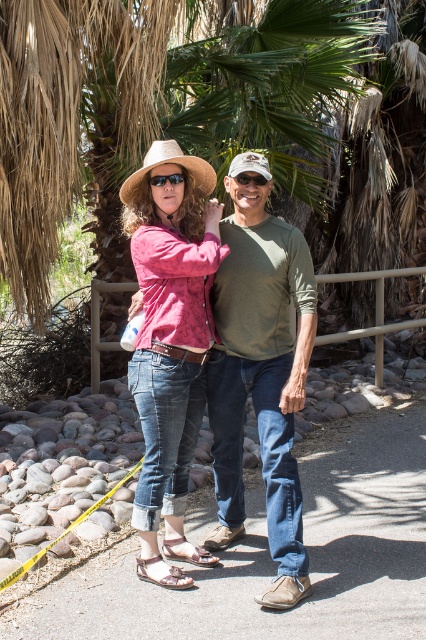
Question: Which of the following is the farthest from the observer?

Choices:
 (A) green matte shirt at center
 (B) white matte cowboy hat at center
 (C) brown leather sandal at lower center

Answer: (C)

Question: Observing the image, what is the correct spatial positioning of leather textured sandal at lower left in reference to matte black sunglasses at center?

Choices:
 (A) above
 (B) below

Answer: (B)

Question: Does brown textured palm tree at center have a larger size compared to matte pink shirt at center?

Choices:
 (A) yes
 (B) no

Answer: (B)

Question: Among these points, which one is nearest to the camera?

Choices:
 (A) (249, 177)
 (B) (141, 536)
 (C) (273, 605)

Answer: (C)

Question: Estimate the real-world distances between objects in this image. Which object is farther from the white matte cowboy hat at center?

Choices:
 (A) matte black sunglasses at center
 (B) straw hat at center

Answer: (A)

Question: Can you confirm if leather textured sandal at lower left is thinner than black matte goggles at center?

Choices:
 (A) no
 (B) yes

Answer: (A)